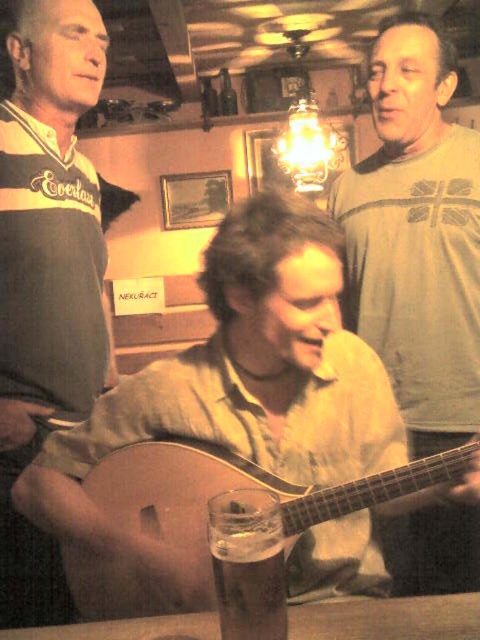
Is wooden acoustic guitar at center taller than dark gray jersey at left?

No.

Where is `wooden acoustic guitar at center`? The image size is (480, 640). wooden acoustic guitar at center is located at coordinates (237, 390).

You are a GUI agent. You are given a task and a screenshot of the screen. Output one action in this format:
    pyautogui.click(x=<x>, y=<y>)
    Task: Click on the wooden acoustic guitar at center
    The width and height of the screenshot is (480, 640).
    Given the screenshot: What is the action you would take?
    pyautogui.click(x=237, y=390)

Who is lower down, wooden acoustic guitar at center or light brown wooden guitar at center?

Positioned lower is light brown wooden guitar at center.

How much distance is there between wooden acoustic guitar at center and light brown wooden guitar at center?

wooden acoustic guitar at center and light brown wooden guitar at center are 11.25 centimeters apart from each other.

Is point (251, 333) in front of point (394, 468)?

Yes, point (251, 333) is in front of point (394, 468).

You are a GUI agent. You are given a task and a screenshot of the screen. Output one action in this format:
    pyautogui.click(x=<x>, y=<y>)
    Task: Click on the wooden acoustic guitar at center
    The height and width of the screenshot is (640, 480).
    Given the screenshot: What is the action you would take?
    [x=237, y=390]

The image size is (480, 640). What do you see at coordinates (237, 390) in the screenshot?
I see `wooden acoustic guitar at center` at bounding box center [237, 390].

Does wooden acoustic guitar at center appear over matte brown guitar at center?

No.

Is point (350, 406) behind point (457, 392)?

No, (350, 406) is closer to viewer.

The height and width of the screenshot is (640, 480). What are the coordinates of `wooden acoustic guitar at center` in the screenshot? It's located at (237, 390).